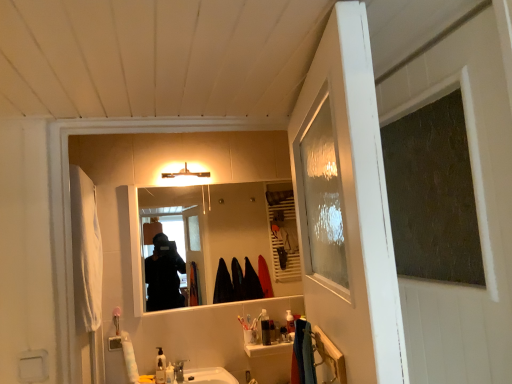
The image size is (512, 384). What do you see at coordinates (179, 370) in the screenshot?
I see `satin nickel faucet at sink center` at bounding box center [179, 370].

At what (x,y) coordinates should I click in order to perform the action: click on clear glass screen door at right. Please return your answer as a coordinate pair (x, y). Looking at the image, I should click on (347, 197).

Measure the distance between translucent plastic soap dispenser at lower center, placed as the 1th toiletry when sorted from left to right, and camera.

The distance of translucent plastic soap dispenser at lower center, placed as the 1th toiletry when sorted from left to right, from camera is 8.44 feet.

Describe the element at coordinates (160, 359) in the screenshot. I see `translucent plastic soap dispenser at lower center, acting as the 5th toiletry starting from the right` at that location.

The height and width of the screenshot is (384, 512). What do you see at coordinates (170, 374) in the screenshot?
I see `translucent plastic soap dispenser at lower center, which ranks as the third toiletry in right-to-left order` at bounding box center [170, 374].

Identify the location of matte white light fixture at upper center. The width and height of the screenshot is (512, 384). (185, 173).

Is translucent plastic soap dispenser at center, the first toiletry from the back, oriented away from matte white light fixture at upper center?

translucent plastic soap dispenser at center, the first toiletry from the back, does not have its back to matte white light fixture at upper center.

From a real-world perspective, is translucent plastic soap dispenser at center, which appears as the first toiletry when viewed from the right, located higher than matte white light fixture at upper center?

No, from a real-world perspective, translucent plastic soap dispenser at center, which appears as the first toiletry when viewed from the right, is not on top of matte white light fixture at upper center.

At what (x,y) coordinates should I click in order to perform the action: click on light fixture on the left of translucent plastic soap dispenser at center, placed as the fifth toiletry when sorted from front to back. Please return your answer as a coordinate pair (x, y). This screenshot has width=512, height=384. Looking at the image, I should click on (185, 173).

Based on their sizes in the image, would you say translucent plastic soap dispenser at center, which appears as the first toiletry when viewed from the right, is bigger or smaller than matte white light fixture at upper center?

Clearly, translucent plastic soap dispenser at center, which appears as the first toiletry when viewed from the right, is smaller in size than matte white light fixture at upper center.

From the image's perspective, who appears lower, translucent plastic soap dispenser at center, the first toiletry from the back, or satin nickel faucet at sink center?

satin nickel faucet at sink center appears lower in the image.

Is translucent plastic soap dispenser at center, which appears as the first toiletry when viewed from the right, facing away from satin nickel faucet at sink center?

No, satin nickel faucet at sink center is not at the back of translucent plastic soap dispenser at center, which appears as the first toiletry when viewed from the right.

Considering the positions of objects translucent plastic soap dispenser at center, arranged as the 5th toiletry when viewed from the left, and satin nickel faucet at sink center in the image provided, who is more to the left, translucent plastic soap dispenser at center, arranged as the 5th toiletry when viewed from the left, or satin nickel faucet at sink center?

satin nickel faucet at sink center.

Considering the sizes of objects translucent plastic soap dispenser at center, which appears as the first toiletry when viewed from the right, and satin nickel faucet at sink center in the image provided, who is bigger, translucent plastic soap dispenser at center, which appears as the first toiletry when viewed from the right, or satin nickel faucet at sink center?

satin nickel faucet at sink center is bigger.

How many degrees apart are the facing directions of translucent plastic toothbrush holder at center, the 2th toiletry positioned from the right, and translucent plastic soap dispenser at lower center, acting as the fifth toiletry starting from the back?

0.0898 degrees.

Would you say translucent plastic toothbrush holder at center, arranged as the fourth toiletry when viewed from the left, is a long distance from translucent plastic soap dispenser at lower center, the 2th toiletry from the left?

They are positioned close to each other.

Would you say translucent plastic toothbrush holder at center, the 2th toiletry positioned from the right, is outside translucent plastic soap dispenser at lower center, the 2th toiletry from the left?

Indeed, translucent plastic toothbrush holder at center, the 2th toiletry positioned from the right, is completely outside translucent plastic soap dispenser at lower center, the 2th toiletry from the left.

Can you confirm if translucent plastic toothbrush holder at center, arranged as the fourth toiletry when viewed from the left, is positioned to the left of translucent plastic soap dispenser at lower center, acting as the fifth toiletry starting from the back?

In fact, translucent plastic toothbrush holder at center, arranged as the fourth toiletry when viewed from the left, is to the right of translucent plastic soap dispenser at lower center, acting as the fifth toiletry starting from the back.

Between satin nickel faucet at sink center and translucent plastic toothbrush holder at center, arranged as the 4th toiletry when viewed from the front, which one has less height?

Standing shorter between the two is satin nickel faucet at sink center.

Based on the photo, considering the relative positions of satin nickel faucet at sink center and translucent plastic toothbrush holder at center, arranged as the fourth toiletry when viewed from the left, in the image provided, is satin nickel faucet at sink center to the left of translucent plastic toothbrush holder at center, arranged as the fourth toiletry when viewed from the left, from the viewer's perspective?

Yes, satin nickel faucet at sink center is to the left of translucent plastic toothbrush holder at center, arranged as the fourth toiletry when viewed from the left.

What's the angular difference between satin nickel faucet at sink center and translucent plastic toothbrush holder at center, the 2th toiletry from the back,'s facing directions?

0.0896 degrees.

The width and height of the screenshot is (512, 384). In order to click on faucet lying in front of the translucent plastic toothbrush holder at center, arranged as the 4th toiletry when viewed from the front in this screenshot , I will do pyautogui.click(x=179, y=370).

Does translucent plastic soap dispenser at lower center, which is the 4th toiletry in right-to-left order, turn towards translucent plastic soap dispenser at lower center, the 4th toiletry from the back?

No, translucent plastic soap dispenser at lower center, which is the 4th toiletry in right-to-left order, is not oriented towards translucent plastic soap dispenser at lower center, the 4th toiletry from the back.

From a real-world perspective, count 1st toiletrys upward from the translucent plastic soap dispenser at lower center, which ranks as the third toiletry in right-to-left order, and point to it. Please provide its 2D coordinates.

[(160, 372)]

Considering the positions of point (158, 358) and point (167, 382), is point (158, 358) closer or farther from the camera than point (167, 382)?

Clearly, point (158, 358) is more distant from the camera than point (167, 382).

Can you confirm if translucent plastic soap dispenser at lower center, acting as the fifth toiletry starting from the back, is thinner than translucent plastic soap dispenser at lower center, the 4th toiletry from the back?

No, translucent plastic soap dispenser at lower center, acting as the fifth toiletry starting from the back, is not thinner than translucent plastic soap dispenser at lower center, the 4th toiletry from the back.

Is matte white light fixture at upper center at the right side of translucent plastic soap dispenser at lower center, the third toiletry from the left?

Correct, you'll find matte white light fixture at upper center to the right of translucent plastic soap dispenser at lower center, the third toiletry from the left.

In terms of height, does matte white light fixture at upper center look taller or shorter compared to translucent plastic soap dispenser at lower center, which ranks as the third toiletry in right-to-left order?

Clearly, matte white light fixture at upper center is taller compared to translucent plastic soap dispenser at lower center, which ranks as the third toiletry in right-to-left order.

Could you tell me if matte white light fixture at upper center is turned towards translucent plastic soap dispenser at lower center, the third toiletry from the left?

No, matte white light fixture at upper center is not oriented towards translucent plastic soap dispenser at lower center, the third toiletry from the left.

From the image's perspective, count 5th toiletrys downward from the matte white light fixture at upper center and point to it. Please provide its 2D coordinates.

[(170, 374)]

Considering the positions of objects translucent plastic soap dispenser at center, placed as the fifth toiletry when sorted from front to back, and smooth reflective mirror at center in the image provided, who is more to the left, translucent plastic soap dispenser at center, placed as the fifth toiletry when sorted from front to back, or smooth reflective mirror at center?

smooth reflective mirror at center.

Is translucent plastic soap dispenser at center, arranged as the 5th toiletry when viewed from the left, not inside smooth reflective mirror at center?

Yes, translucent plastic soap dispenser at center, arranged as the 5th toiletry when viewed from the left, is outside of smooth reflective mirror at center.

From the picture: Is translucent plastic soap dispenser at center, placed as the fifth toiletry when sorted from front to back, turned away from smooth reflective mirror at center?

No, translucent plastic soap dispenser at center, placed as the fifth toiletry when sorted from front to back,'s orientation is not away from smooth reflective mirror at center.

Identify the location of light fixture above the translucent plastic soap dispenser at center, placed as the fifth toiletry when sorted from front to back (from the image's perspective). Image resolution: width=512 pixels, height=384 pixels. [185, 173].

This screenshot has height=384, width=512. Find the location of `faucet in front of the translucent plastic soap dispenser at center, placed as the fifth toiletry when sorted from front to back`. faucet in front of the translucent plastic soap dispenser at center, placed as the fifth toiletry when sorted from front to back is located at coordinates (179, 370).

From the picture: Which object lies further to the anchor point translucent plastic soap dispenser at lower center, arranged as the second toiletry when viewed from the front, translucent plastic toothbrush holder at center, arranged as the 4th toiletry when viewed from the front, or translucent plastic soap dispenser at lower center, which is the 4th toiletry in right-to-left order?

translucent plastic toothbrush holder at center, arranged as the 4th toiletry when viewed from the front.

Based on their spatial positions, is clear glass screen door at right or satin nickel faucet at sink center further from matte white light fixture at upper center?

clear glass screen door at right is positioned further to the anchor matte white light fixture at upper center.

From the image, which object appears to be nearer to clear glass screen door at right, translucent plastic soap dispenser at lower center, which ranks as the third toiletry in right-to-left order, or translucent plastic soap dispenser at center, placed as the fifth toiletry when sorted from front to back?

translucent plastic soap dispenser at center, placed as the fifth toiletry when sorted from front to back, is closer to clear glass screen door at right.

Based on their spatial positions, is clear glass screen door at right or translucent plastic toothbrush holder at center, the 2th toiletry positioned from the right, closer to smooth reflective mirror at center?

The object closer to smooth reflective mirror at center is translucent plastic toothbrush holder at center, the 2th toiletry positioned from the right.

Looking at the image, which one is located closer to translucent plastic soap dispenser at center, the first toiletry from the back, translucent plastic soap dispenser at lower center, acting as the fifth toiletry starting from the back, or translucent plastic toothbrush holder at center, the 2th toiletry from the back?

translucent plastic toothbrush holder at center, the 2th toiletry from the back, is positioned closer to the anchor translucent plastic soap dispenser at center, the first toiletry from the back.

Based on their spatial positions, is smooth reflective mirror at center or translucent plastic toothbrush holder at center, the 2th toiletry from the back, closer to satin nickel faucet at sink center?

The object closer to satin nickel faucet at sink center is translucent plastic toothbrush holder at center, the 2th toiletry from the back.

Looking at the image, which one is located closer to satin nickel faucet at sink center, matte white light fixture at upper center or white cotton robe at left?

The object closer to satin nickel faucet at sink center is white cotton robe at left.

Estimate the real-world distances between objects in this image. Which object is closer to satin nickel faucet at sink center, translucent plastic soap dispenser at lower center, which ranks as the third toiletry in back-to-front order, or clear glass screen door at right?

Based on the image, translucent plastic soap dispenser at lower center, which ranks as the third toiletry in back-to-front order, appears to be nearer to satin nickel faucet at sink center.

Find the location of a particular element. The image size is (512, 384). faucet between translucent plastic soap dispenser at lower center, which ranks as the third toiletry in right-to-left order, and translucent plastic soap dispenser at center, which appears as the first toiletry when viewed from the right, from left to right is located at coordinates (179, 370).

Where is `robe between matte white light fixture at upper center and translucent plastic soap dispenser at lower center, which is the 4th toiletry in right-to-left order, in the vertical direction`? robe between matte white light fixture at upper center and translucent plastic soap dispenser at lower center, which is the 4th toiletry in right-to-left order, in the vertical direction is located at coordinates point(86,251).

Where is `toiletry situated between translucent plastic soap dispenser at lower center, which is the 4th toiletry in right-to-left order, and satin nickel faucet at sink center from left to right`? The height and width of the screenshot is (384, 512). toiletry situated between translucent plastic soap dispenser at lower center, which is the 4th toiletry in right-to-left order, and satin nickel faucet at sink center from left to right is located at coordinates (170, 374).

You are a GUI agent. You are given a task and a screenshot of the screen. Output one action in this format:
    pyautogui.click(x=<x>, y=<y>)
    Task: Click on the toiletry between matte white light fixture at upper center and translucent plastic toothbrush holder at center, the 2th toiletry positioned from the right, from top to bottom
    
    Given the screenshot: What is the action you would take?
    pyautogui.click(x=290, y=322)